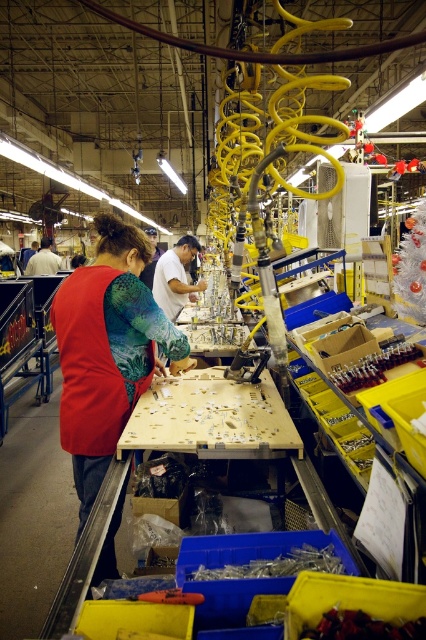
Is red fabric vest at center to the right of metallic blue screwdriver at lower center from the viewer's perspective?

Incorrect, red fabric vest at center is not on the right side of metallic blue screwdriver at lower center.

Between point (138, 316) and point (175, 595), which one is positioned behind?

The point (138, 316) is behind.

Image resolution: width=426 pixels, height=640 pixels. I want to click on red fabric vest at center, so click(x=106, y=349).

Which is behind, point (157, 358) or point (344, 384)?

Point (157, 358)

Describe the element at coordinates (106, 349) in the screenshot. I see `red fabric vest at center` at that location.

Describe the element at coordinates (106, 349) in the screenshot. I see `red fabric vest at center` at that location.

You are a GUI agent. You are given a task and a screenshot of the screen. Output one action in this format:
    pyautogui.click(x=<x>, y=<y>)
    Task: Click on the red fabric vest at center
    This screenshot has height=640, width=426.
    Given the screenshot: What is the action you would take?
    pyautogui.click(x=106, y=349)

Which is more to the left, red fabric shirt at center or metallic blue screwdriver at lower center?

Positioned to the left is red fabric shirt at center.

Is red fabric shirt at center below metallic blue screwdriver at lower center?

No, red fabric shirt at center is not below metallic blue screwdriver at lower center.

Find the location of a particular element. Image resolution: width=426 pixels, height=640 pixels. red fabric shirt at center is located at coordinates click(x=43, y=260).